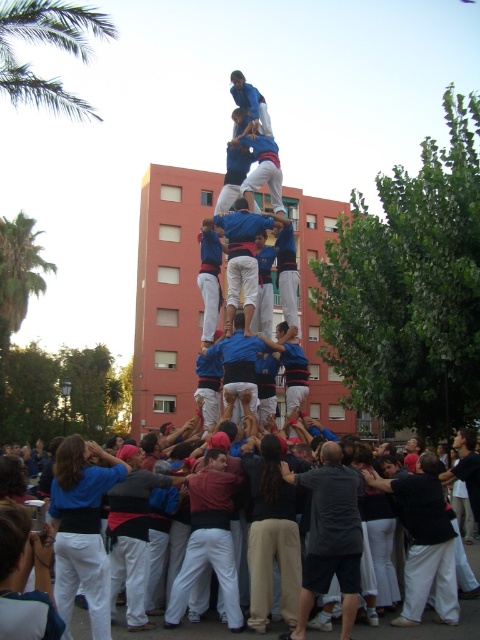
Based on the photo, who is positioned more to the right, dark gray shirt at center or black cotton shirt at lower right?

From the viewer's perspective, black cotton shirt at lower right appears more on the right side.

What are the coordinates of `dark gray shirt at center` in the screenshot? It's located at (330, 536).

Is point (340, 630) closer to viewer compared to point (444, 579)?

Yes, point (340, 630) is in front of point (444, 579).

The image size is (480, 640). I want to click on dark gray shirt at center, so [x=330, y=536].

Which is in front, point (419, 493) or point (232, 310)?

Point (419, 493) is more forward.

Is black cotton shirt at lower right smaller than blue fabric at center?

Incorrect, black cotton shirt at lower right is not smaller in size than blue fabric at center.

Is point (412, 612) farther from camera compared to point (235, 232)?

No.

Where is `black cotton shirt at lower right`? The height and width of the screenshot is (640, 480). black cotton shirt at lower right is located at coordinates (423, 541).

Which is below, dark gray shirt at center or green leafy palm tree at left?

dark gray shirt at center is lower down.

Which is more to the left, dark gray shirt at center or green leafy palm tree at left?

From the viewer's perspective, green leafy palm tree at left appears more on the left side.

Describe the element at coordinates (330, 536) in the screenshot. The width and height of the screenshot is (480, 640). I see `dark gray shirt at center` at that location.

Where is `dark gray shirt at center`? This screenshot has width=480, height=640. dark gray shirt at center is located at coordinates tap(330, 536).